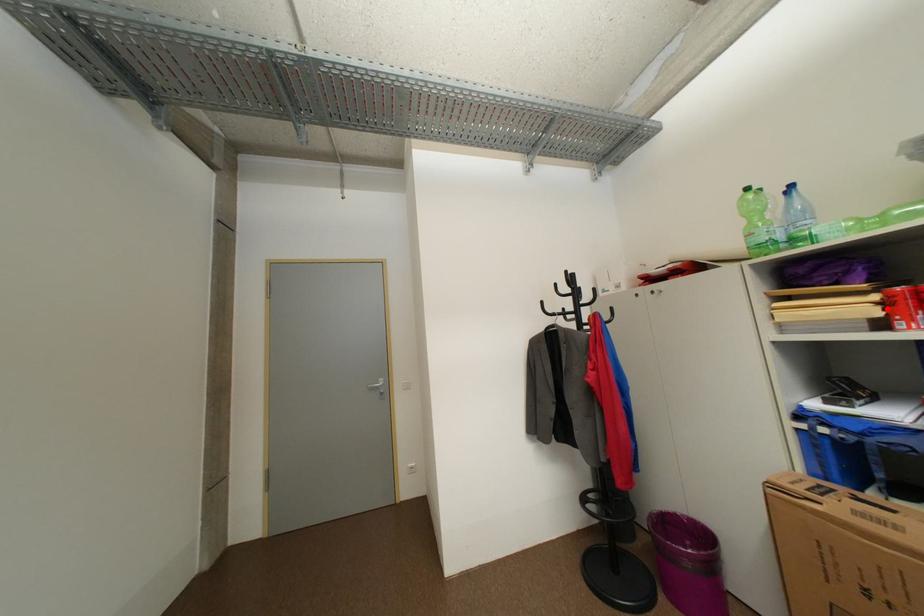
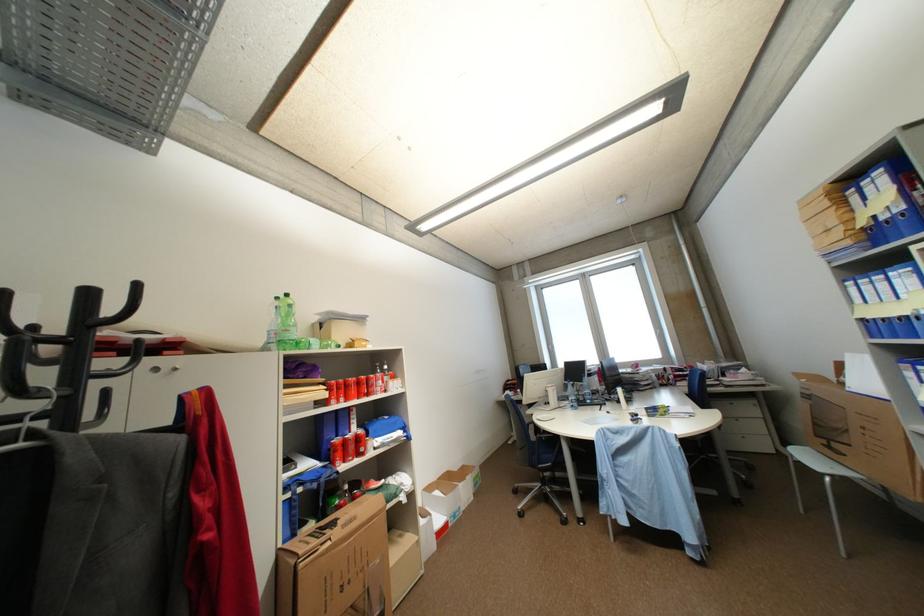
Where in the second image is the point corresponding to the highlighted location from the first image?

(335, 392)